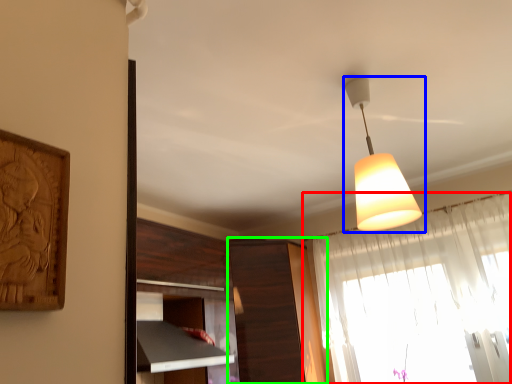
Question: Which object is positioned closest to curtain (highlighted by a red box)? Select from lamp (highlighted by a blue box) and cabinetry (highlighted by a green box).

Choices:
 (A) lamp
 (B) cabinetry

Answer: (B)